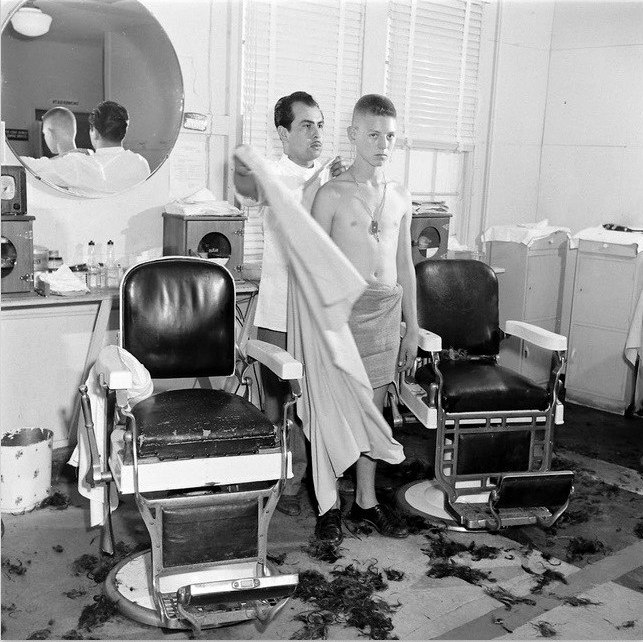
The height and width of the screenshot is (642, 643). Identify the location of cabinet. (226, 246), (11, 256).